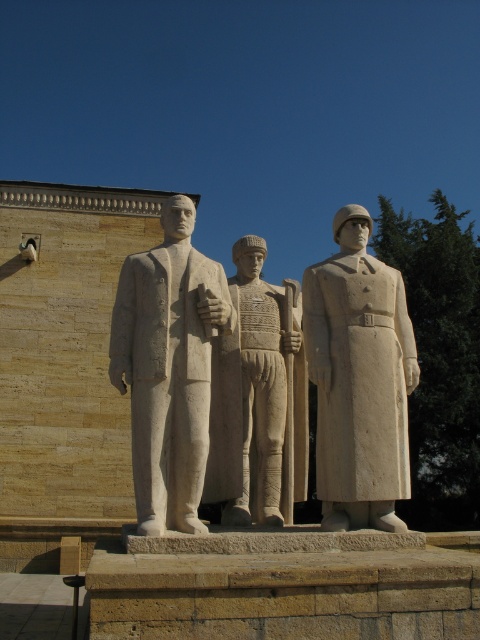
Question: Does white stone soldier at center come behind white stone statue at center?

Choices:
 (A) yes
 (B) no

Answer: (A)

Question: Which point appears closest to the camera in this image?

Choices:
 (A) (287, 282)
 (B) (118, 346)
 (C) (367, 300)

Answer: (B)

Question: Which of the following is the farthest from the observer?

Choices:
 (A) white stone soldier at center
 (B) white stone statue at center

Answer: (A)

Question: Based on their relative distances, which object is nearer to the white stone figure at center?

Choices:
 (A) white stone statue at center
 (B) white stone soldier at center

Answer: (B)

Question: Is white stone soldier at center below white stone statue at center?

Choices:
 (A) yes
 (B) no

Answer: (A)

Question: Is white stone statue at center below white stone figure at center?

Choices:
 (A) yes
 (B) no

Answer: (A)